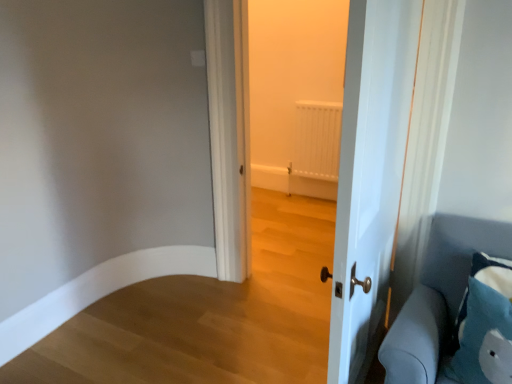
Question: Considering the positions of point (350, 314) and point (484, 326), is point (350, 314) closer or farther from the camera than point (484, 326)?

Choices:
 (A) farther
 (B) closer

Answer: (A)

Question: Is white glossy door at center spatially inside blue fabric pillow at lower right, or outside of it?

Choices:
 (A) inside
 (B) outside

Answer: (B)

Question: Which object is positioned closest to the white glossy door at center?

Choices:
 (A) blue fabric pillow at lower right
 (B) blue fabric pillow at lower right

Answer: (A)

Question: Which of these objects is positioned farthest from the blue fabric pillow at lower right?

Choices:
 (A) white glossy door at center
 (B) blue fabric pillow at lower right

Answer: (A)